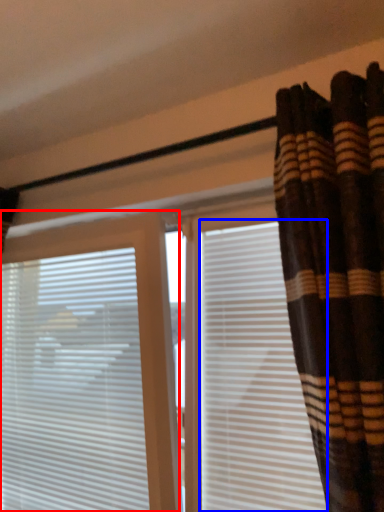
Question: Which object appears farthest to the camera in this image, window blind (highlighted by a red box) or shutter (highlighted by a blue box)?

Choices:
 (A) window blind
 (B) shutter

Answer: (A)